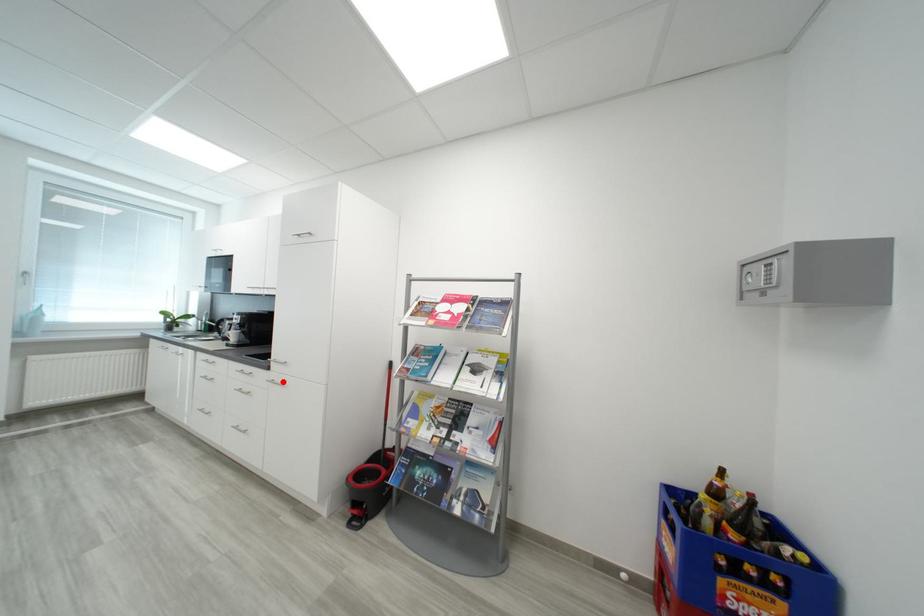
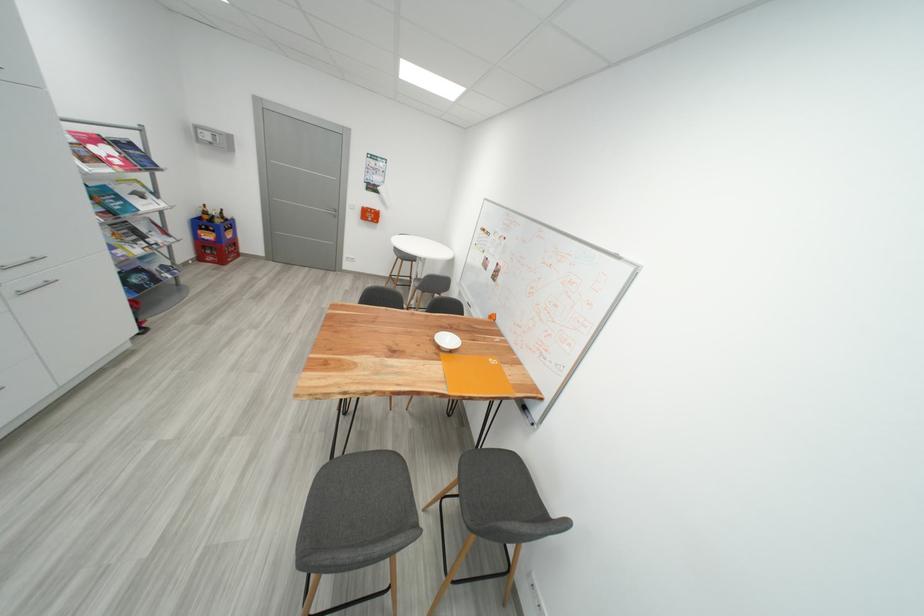
Locate, in the second image, the point that corresponds to the highlighted location in the first image.

(30, 291)